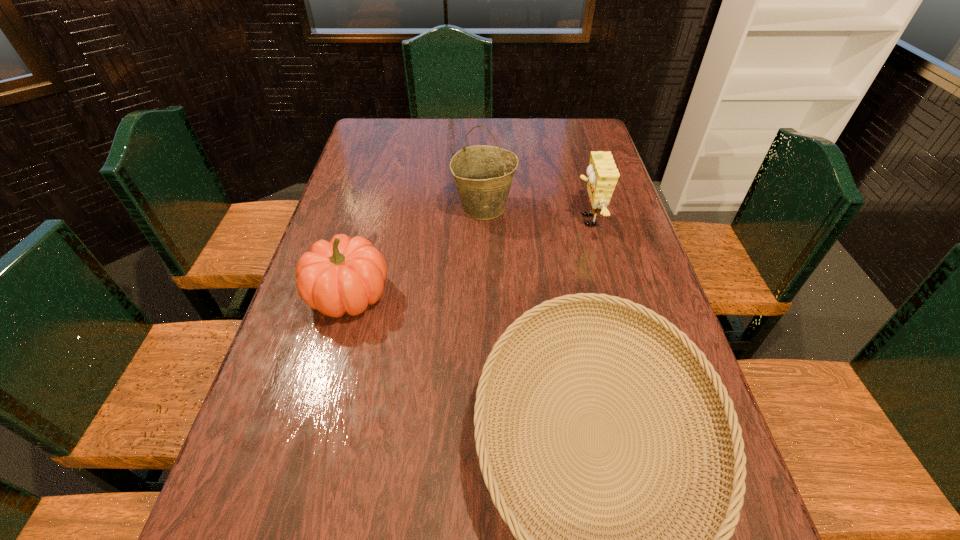
Locate an element on the screen. The width and height of the screenshot is (960, 540). object identified as the third closest to the tallest object is located at coordinates (722, 521).

The image size is (960, 540). In order to click on object that stands as the closest to the sponge in this screenshot , I will do pyautogui.click(x=483, y=174).